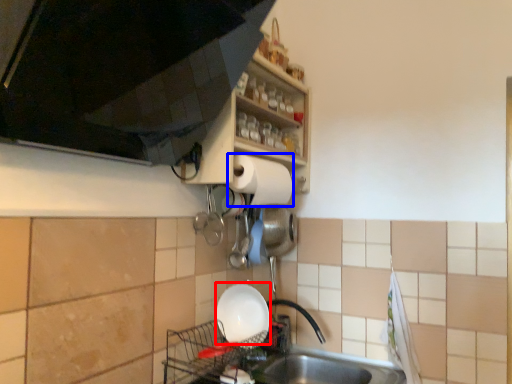
Question: Which point is further to the camera, basin (highlighted by a red box) or paper towel (highlighted by a blue box)?

Choices:
 (A) basin
 (B) paper towel

Answer: (B)